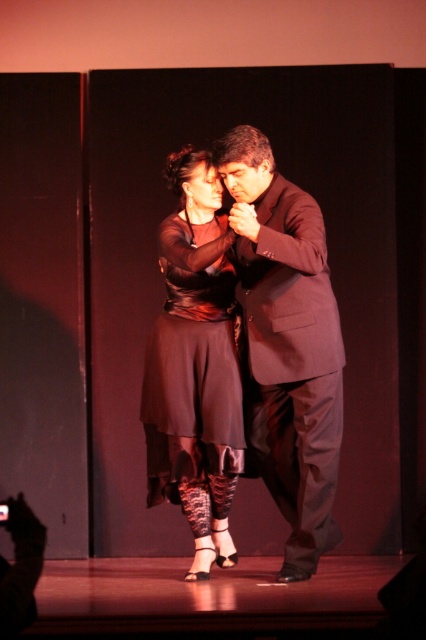
You are a photographer positioned at the back of the stage. You want to capture a photo where both the dark brown suit at center and the black satin dress at center are clearly visible in the frame. Given that your camera has a minimum focus distance of 12 inches, will you be able to focus on both subjects simultaneously?

The dark brown suit at center and the black satin dress at center are 11.87 inches apart. Since the camera requires a minimum focus distance of 12 inches to focus on both subjects, the distance between them is slightly less than required. Therefore, you may not be able to focus on both subjects simultaneously.

You are a photographer at the back of the stage. You need to capture a photo where both the dark brown suit at center and the black satin dress at center are visible in the frame. Based on their positions, which one should you focus on first to ensure they are both in the shot?

Since the dark brown suit at center is to the right of the black satin dress at center, you should focus on the black satin dress at center first to ensure both are within the frame.

Based on the scene description, which object is shorter in height between the dark brown suit at center and the black satin dress at center?

The dark brown suit at center is shorter in height than the black satin dress at center.